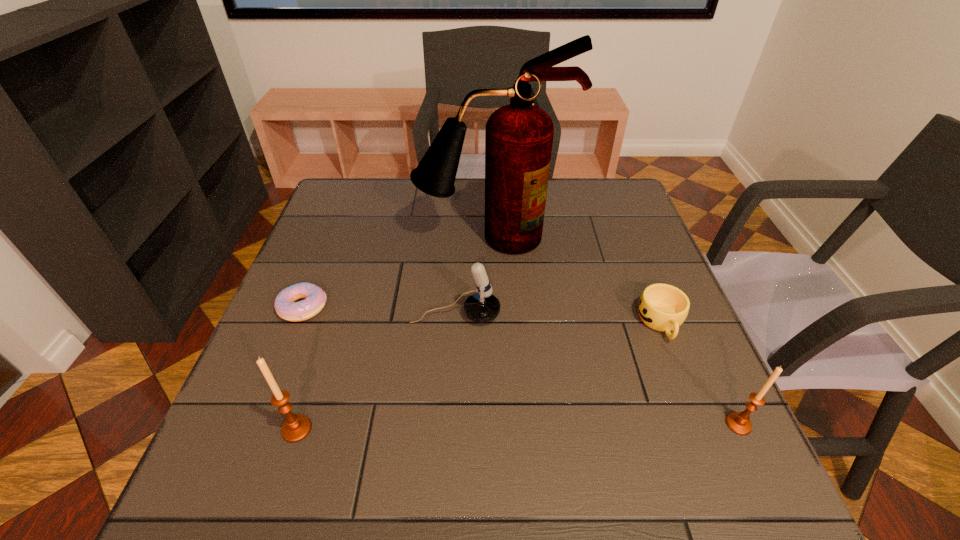
Image resolution: width=960 pixels, height=540 pixels. In order to click on free location that satisfies the following two spatial constraints: 1. at the nozzle of the tallest object; 2. on the right side of the right candle_holder in this screenshot , I will do `click(497, 424)`.

In order to click on blank area in the image that satisfies the following two spatial constraints: 1. on the front side of the doughnut; 2. on the left side of the second tallest object in this screenshot , I will do `click(255, 429)`.